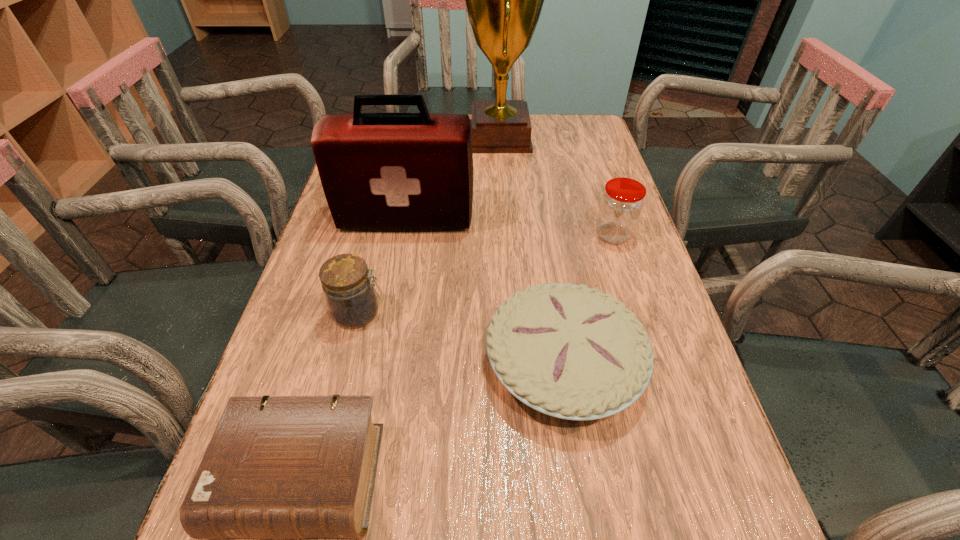
This screenshot has height=540, width=960. Identify the location of the farthest object. click(x=504, y=0).

Locate an element on the screen. The width and height of the screenshot is (960, 540). the tallest object is located at coordinates (504, 0).

What are the coordinates of `the second tallest object` in the screenshot? It's located at (379, 171).

Find the location of a particular element. This screenshot has width=960, height=540. the right jar is located at coordinates (621, 204).

Image resolution: width=960 pixels, height=540 pixels. Find the location of `the nearer jar`. the nearer jar is located at coordinates (352, 300).

In order to click on pie in this screenshot , I will do `click(569, 351)`.

The image size is (960, 540). I want to click on free region located on the plaque of the farthest object, so click(379, 138).

Find the location of a particular element. free space located 0.320m on the plaque of the farthest object is located at coordinates (364, 138).

I want to click on vacant space located on the plaque of the farthest object, so click(373, 138).

Find the location of a particular element. vacant position located on the side of the second tallest object with the cross symbol is located at coordinates (386, 326).